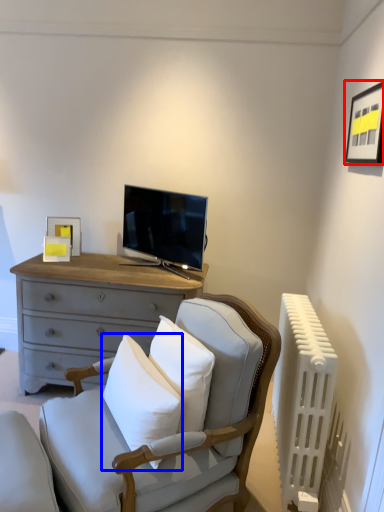
Question: Which of the following is the farthest to the observer, picture frame (highlighted by a red box) or pillow (highlighted by a blue box)?

Choices:
 (A) picture frame
 (B) pillow

Answer: (A)